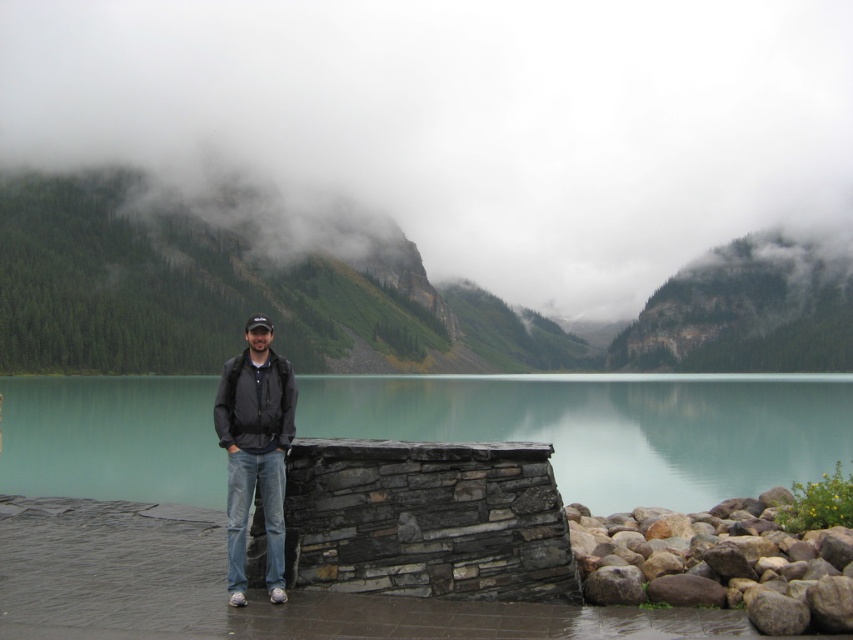
In the scene shown: You are a photographer trying to capture the brown rough rock at lower right and the dark gray jacket at center in the same frame. Which object should you focus on first to ensure both are in focus?

The brown rough rock at lower right is closer to the viewer than the dark gray jacket at center, so you should focus on the brown rough rock at lower right first to ensure both are in focus.

You are standing at the man standing by the stone structure near the tranquil body of water. Looking towards the point marked at coordinates [361,294], what natural feature do you see there?

The point at coordinates [361,294] corresponds to a green forested mountain at upper center.